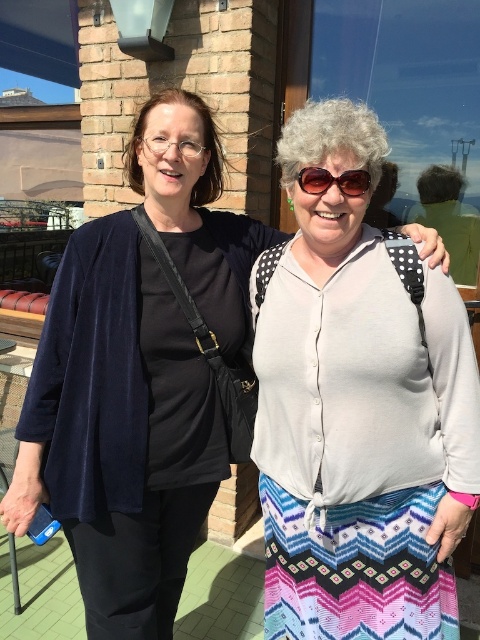
Question: Which object appears closest to the camera in this image?

Choices:
 (A) white textured blouse at center
 (B) brown plastic sunglasses at center

Answer: (A)

Question: Which point is farther from the camera taking this photo?

Choices:
 (A) (354, 184)
 (B) (444, 499)

Answer: (B)

Question: Does white textured blouse at center have a smaller size compared to brown plastic sunglasses at center?

Choices:
 (A) yes
 (B) no

Answer: (B)

Question: In this image, where is white textured blouse at center located relative to brown plastic sunglasses at center?

Choices:
 (A) left
 (B) right

Answer: (B)

Question: Can you confirm if white textured blouse at center is bigger than brown plastic sunglasses at center?

Choices:
 (A) no
 (B) yes

Answer: (B)

Question: Which point appears closest to the camera in this image?

Choices:
 (A) (330, 125)
 (B) (347, 195)

Answer: (A)